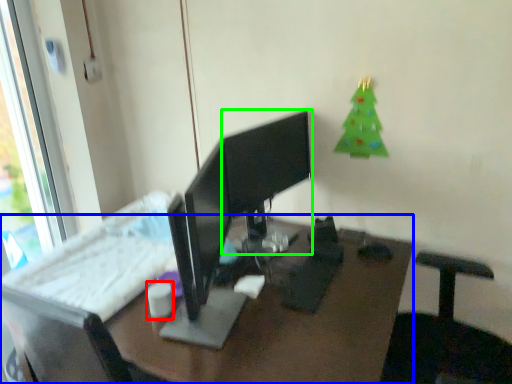
Question: Based on their relative distances, which object is farther from tableware (highlighted by a red box)? Choose from desk (highlighted by a blue box) and computer monitor (highlighted by a green box).

Choices:
 (A) desk
 (B) computer monitor

Answer: (B)